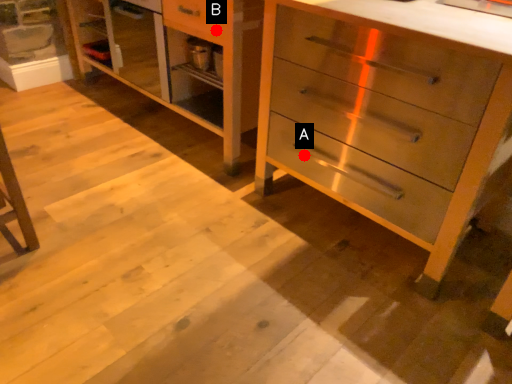
Question: Two points are circled on the image, labeled by A and B beside each circle. Which point is closer to the camera taking this photo?

Choices:
 (A) A is closer
 (B) B is closer

Answer: (A)